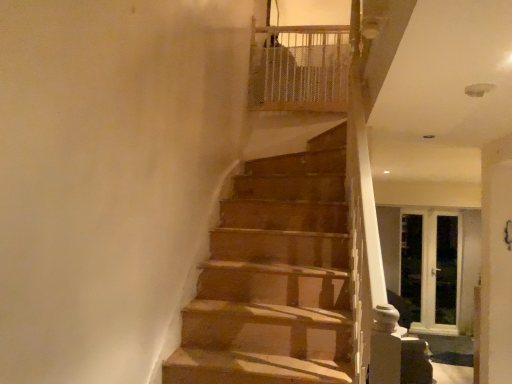
What do you see at coordinates (430, 268) in the screenshot? Image resolution: width=512 pixels, height=384 pixels. I see `white wooden screen door at right, which is the 2th screen door from right to left` at bounding box center [430, 268].

What do you see at coordinates (411, 266) in the screenshot? I see `clear glass screen door at right, acting as the 3th screen door starting from the right` at bounding box center [411, 266].

You are a GUI agent. You are given a task and a screenshot of the screen. Output one action in this format:
    pyautogui.click(x=<x>, y=<y>)
    Task: Click on the white wooden screen door at right, positioned as the second screen door in left-to-right order
    The width and height of the screenshot is (512, 384).
    Given the screenshot: What is the action you would take?
    pyautogui.click(x=430, y=268)

Considering the relative sizes of white glass screen door at right, arranged as the third screen door when viewed from the left, and white mesh balustrade at upper center in the image provided, is white glass screen door at right, arranged as the third screen door when viewed from the left, wider than white mesh balustrade at upper center?

No.

From the image's perspective, which object appears higher, white glass screen door at right, arranged as the third screen door when viewed from the left, or white mesh balustrade at upper center?

white mesh balustrade at upper center appears higher in the image.

Is white glass screen door at right, the first screen door in the right-to-left sequence, directly adjacent to white mesh balustrade at upper center?

No, white glass screen door at right, the first screen door in the right-to-left sequence, is not with white mesh balustrade at upper center.

Is point (443, 227) positioned behind point (265, 59)?

Yes, point (443, 227) is behind point (265, 59).

How distant is white glass screen door at right, arranged as the third screen door when viewed from the left, from white wooden screen door at right, positioned as the second screen door in left-to-right order?

A distance of 4.13 inches exists between white glass screen door at right, arranged as the third screen door when viewed from the left, and white wooden screen door at right, positioned as the second screen door in left-to-right order.

How different are the orientations of white glass screen door at right, arranged as the third screen door when viewed from the left, and white wooden screen door at right, positioned as the second screen door in left-to-right order, in degrees?

white glass screen door at right, arranged as the third screen door when viewed from the left, and white wooden screen door at right, positioned as the second screen door in left-to-right order, are facing 0.00234 degrees away from each other.

Does white glass screen door at right, arranged as the third screen door when viewed from the left, turn towards white wooden screen door at right, positioned as the second screen door in left-to-right order?

Yes, white glass screen door at right, arranged as the third screen door when viewed from the left, is turned towards white wooden screen door at right, positioned as the second screen door in left-to-right order.

From the picture: Is white glass screen door at right, arranged as the third screen door when viewed from the left, situated inside white wooden screen door at right, positioned as the second screen door in left-to-right order, or outside?

white glass screen door at right, arranged as the third screen door when viewed from the left, fits inside white wooden screen door at right, positioned as the second screen door in left-to-right order.

Which object is positioned more to the right, clear glass screen door at right, acting as the 3th screen door starting from the right, or white mesh balustrade at upper center?

clear glass screen door at right, acting as the 3th screen door starting from the right.

Who is smaller, clear glass screen door at right, acting as the 3th screen door starting from the right, or white mesh balustrade at upper center?

Smaller between the two is clear glass screen door at right, acting as the 3th screen door starting from the right.

How different are the orientations of clear glass screen door at right, acting as the 3th screen door starting from the right, and white mesh balustrade at upper center in degrees?

The angle between the facing direction of clear glass screen door at right, acting as the 3th screen door starting from the right, and the facing direction of white mesh balustrade at upper center is 0.747 degrees.

From the image's perspective, is clear glass screen door at right, acting as the 3th screen door starting from the right, positioned above or below white mesh balustrade at upper center?

Based on their image positions, clear glass screen door at right, acting as the 3th screen door starting from the right, is located beneath white mesh balustrade at upper center.

Is white mesh balustrade at upper center positioned far away from clear glass screen door at right, acting as the 3th screen door starting from the right?

Yes, white mesh balustrade at upper center is far from clear glass screen door at right, acting as the 3th screen door starting from the right.

Consider the image. From a real-world perspective, is white mesh balustrade at upper center physically below clear glass screen door at right, which ranks as the 1th screen door in left-to-right order?

Actually, white mesh balustrade at upper center is physically above clear glass screen door at right, which ranks as the 1th screen door in left-to-right order, in the real world.

Between white mesh balustrade at upper center and clear glass screen door at right, which ranks as the 1th screen door in left-to-right order, which one has larger size?

With larger size is white mesh balustrade at upper center.

Does point (294, 76) appear closer or farther from the camera than point (409, 326)?

Point (294, 76) appears to be closer to the viewer than point (409, 326).

Are clear glass screen door at right, which ranks as the 1th screen door in left-to-right order, and white glass screen door at right, arranged as the third screen door when viewed from the left, making contact?

No, clear glass screen door at right, which ranks as the 1th screen door in left-to-right order, is not next to white glass screen door at right, arranged as the third screen door when viewed from the left.

Can you confirm if clear glass screen door at right, which ranks as the 1th screen door in left-to-right order, is thinner than white glass screen door at right, the first screen door in the right-to-left sequence?

Yes, clear glass screen door at right, which ranks as the 1th screen door in left-to-right order, is thinner than white glass screen door at right, the first screen door in the right-to-left sequence.

Who is bigger, clear glass screen door at right, which ranks as the 1th screen door in left-to-right order, or white glass screen door at right, arranged as the third screen door when viewed from the left?

white glass screen door at right, arranged as the third screen door when viewed from the left.

Considering the sizes of clear glass screen door at right, acting as the 3th screen door starting from the right, and white glass screen door at right, arranged as the third screen door when viewed from the left, in the image, is clear glass screen door at right, acting as the 3th screen door starting from the right, taller or shorter than white glass screen door at right, arranged as the third screen door when viewed from the left,?

Considering their sizes, clear glass screen door at right, acting as the 3th screen door starting from the right, has more height than white glass screen door at right, arranged as the third screen door when viewed from the left.

Would you say white glass screen door at right, arranged as the third screen door when viewed from the left, is to the left or to the right of clear glass screen door at right, which ranks as the 1th screen door in left-to-right order, in the picture?

white glass screen door at right, arranged as the third screen door when viewed from the left, is to the right of clear glass screen door at right, which ranks as the 1th screen door in left-to-right order.

Considering the relative sizes of white glass screen door at right, the first screen door in the right-to-left sequence, and clear glass screen door at right, which ranks as the 1th screen door in left-to-right order, in the image provided, is white glass screen door at right, the first screen door in the right-to-left sequence, wider than clear glass screen door at right, which ranks as the 1th screen door in left-to-right order,?

Yes.

How many degrees apart are the facing directions of white glass screen door at right, arranged as the third screen door when viewed from the left, and clear glass screen door at right, which ranks as the 1th screen door in left-to-right order?

0.000234 degrees separate the facing orientations of white glass screen door at right, arranged as the third screen door when viewed from the left, and clear glass screen door at right, which ranks as the 1th screen door in left-to-right order.

From the image's perspective, is white glass screen door at right, arranged as the third screen door when viewed from the left, above or below clear glass screen door at right, which ranks as the 1th screen door in left-to-right order?

Clearly, from the image's perspective, white glass screen door at right, arranged as the third screen door when viewed from the left, is below clear glass screen door at right, which ranks as the 1th screen door in left-to-right order.

Looking at this image, is white mesh balustrade at upper center far away from white glass screen door at right, the first screen door in the right-to-left sequence?

Yes, white mesh balustrade at upper center and white glass screen door at right, the first screen door in the right-to-left sequence, are located far from each other.

Which is farther, (262, 57) or (453, 224)?

The point (453, 224) is more distant.

From a real-world perspective, is white mesh balustrade at upper center on top of white glass screen door at right, the first screen door in the right-to-left sequence?

Correct, in the physical world, white mesh balustrade at upper center is higher than white glass screen door at right, the first screen door in the right-to-left sequence.

Is white mesh balustrade at upper center located outside white glass screen door at right, arranged as the third screen door when viewed from the left?

white mesh balustrade at upper center is positioned outside white glass screen door at right, arranged as the third screen door when viewed from the left.

What are the coordinates of `balustrade above the white glass screen door at right, arranged as the third screen door when viewed from the left (from a real-world perspective)` in the screenshot? It's located at (300, 68).

I want to click on screen door located on the right of white wooden screen door at right, positioned as the second screen door in left-to-right order, so click(446, 270).

Considering their positions, is white mesh balustrade at upper center positioned closer to clear glass screen door at right, which ranks as the 1th screen door in left-to-right order, than white wooden screen door at right, which is the 2th screen door from right to left?

white wooden screen door at right, which is the 2th screen door from right to left, is closer to clear glass screen door at right, which ranks as the 1th screen door in left-to-right order.

Estimate the real-world distances between objects in this image. Which object is further from white mesh balustrade at upper center, white wooden screen door at right, positioned as the second screen door in left-to-right order, or white glass screen door at right, arranged as the third screen door when viewed from the left?

white glass screen door at right, arranged as the third screen door when viewed from the left, is positioned further to the anchor white mesh balustrade at upper center.

From the image, which object appears to be nearer to white glass screen door at right, arranged as the third screen door when viewed from the left, white mesh balustrade at upper center or clear glass screen door at right, acting as the 3th screen door starting from the right?

Among the two, clear glass screen door at right, acting as the 3th screen door starting from the right, is located nearer to white glass screen door at right, arranged as the third screen door when viewed from the left.

Based on their spatial positions, is clear glass screen door at right, which ranks as the 1th screen door in left-to-right order, or white glass screen door at right, arranged as the third screen door when viewed from the left, further from white wooden screen door at right, which is the 2th screen door from right to left?

clear glass screen door at right, which ranks as the 1th screen door in left-to-right order, is positioned further to the anchor white wooden screen door at right, which is the 2th screen door from right to left.

From the image, which object appears to be farther from white mesh balustrade at upper center, clear glass screen door at right, acting as the 3th screen door starting from the right, or white wooden screen door at right, positioned as the second screen door in left-to-right order?

The object further to white mesh balustrade at upper center is white wooden screen door at right, positioned as the second screen door in left-to-right order.

When comparing their distances from white wooden screen door at right, positioned as the second screen door in left-to-right order, does white mesh balustrade at upper center or white glass screen door at right, the first screen door in the right-to-left sequence, seem further?

white mesh balustrade at upper center is further to white wooden screen door at right, positioned as the second screen door in left-to-right order.

When comparing their distances from white glass screen door at right, arranged as the third screen door when viewed from the left, does white mesh balustrade at upper center or white wooden screen door at right, which is the 2th screen door from right to left, seem further?

Among the two, white mesh balustrade at upper center is located further to white glass screen door at right, arranged as the third screen door when viewed from the left.

Which object lies nearer to the anchor point white wooden screen door at right, which is the 2th screen door from right to left, white mesh balustrade at upper center or clear glass screen door at right, acting as the 3th screen door starting from the right?

The object closer to white wooden screen door at right, which is the 2th screen door from right to left, is clear glass screen door at right, acting as the 3th screen door starting from the right.

Where is `screen door between white mesh balustrade at upper center and white wooden screen door at right, which is the 2th screen door from right to left, along the z-axis`? screen door between white mesh balustrade at upper center and white wooden screen door at right, which is the 2th screen door from right to left, along the z-axis is located at coordinates (446, 270).

At what (x,y) coordinates should I click in order to perform the action: click on screen door between clear glass screen door at right, acting as the 3th screen door starting from the right, and white glass screen door at right, arranged as the third screen door when viewed from the left, from left to right. Please return your answer as a coordinate pair (x, y). Looking at the image, I should click on (430, 268).